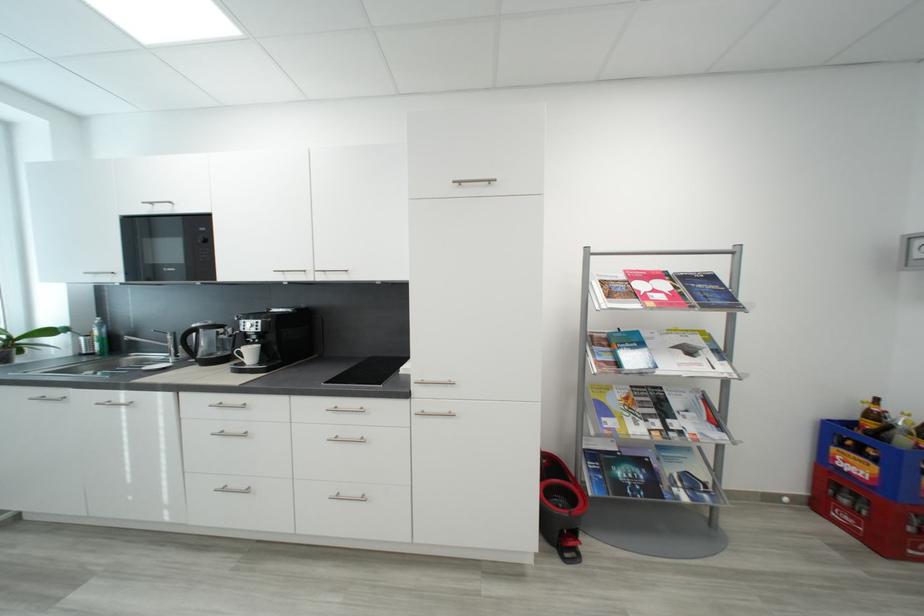
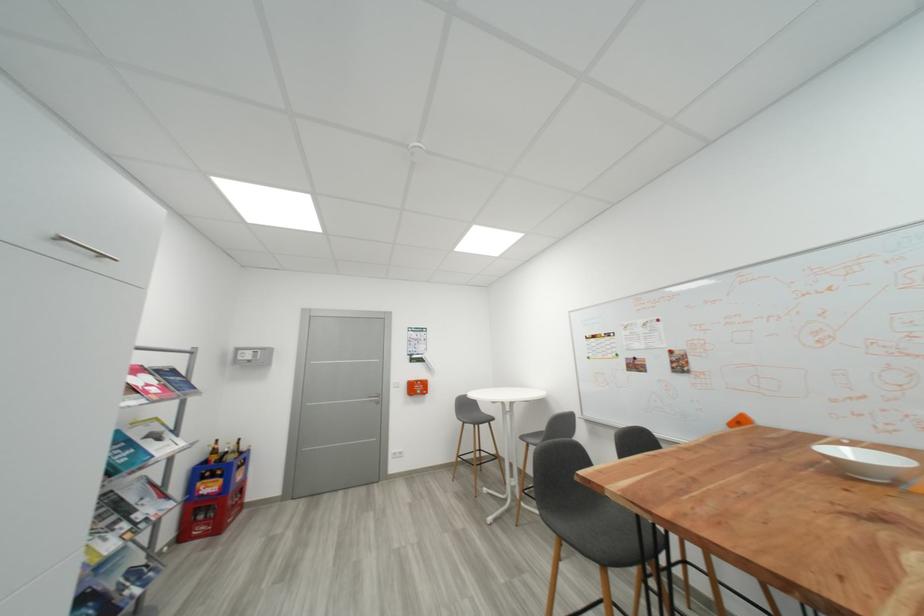
Locate, in the second image, the point that corresponds to point (823, 507) in the first image.

(189, 538)